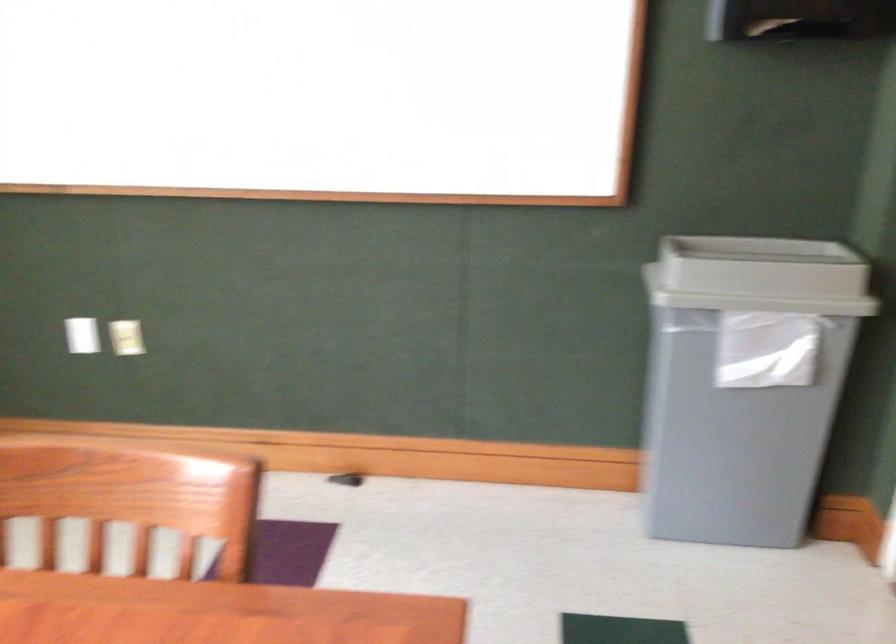
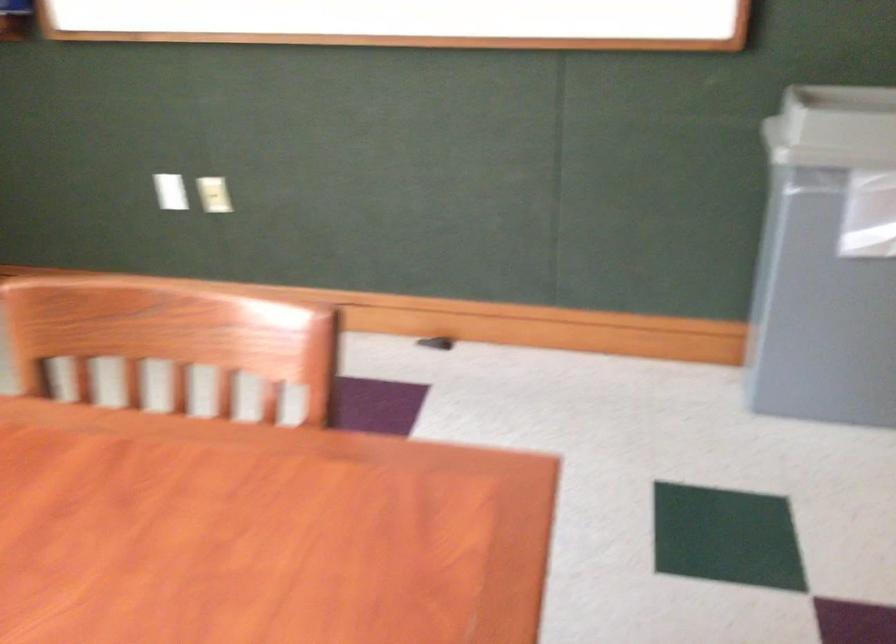
Question: The images are taken continuously from a first-person perspective. In which direction are you moving?

Choices:
 (A) Left
 (B) Right
 (C) Forward
 (D) Backward

Answer: (C)